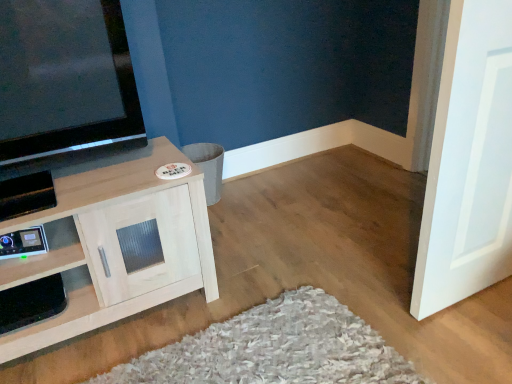
Where is `vacant area on top of light wood cabinet at left (from a real-world perspective)`? The width and height of the screenshot is (512, 384). vacant area on top of light wood cabinet at left (from a real-world perspective) is located at coordinates (x=94, y=177).